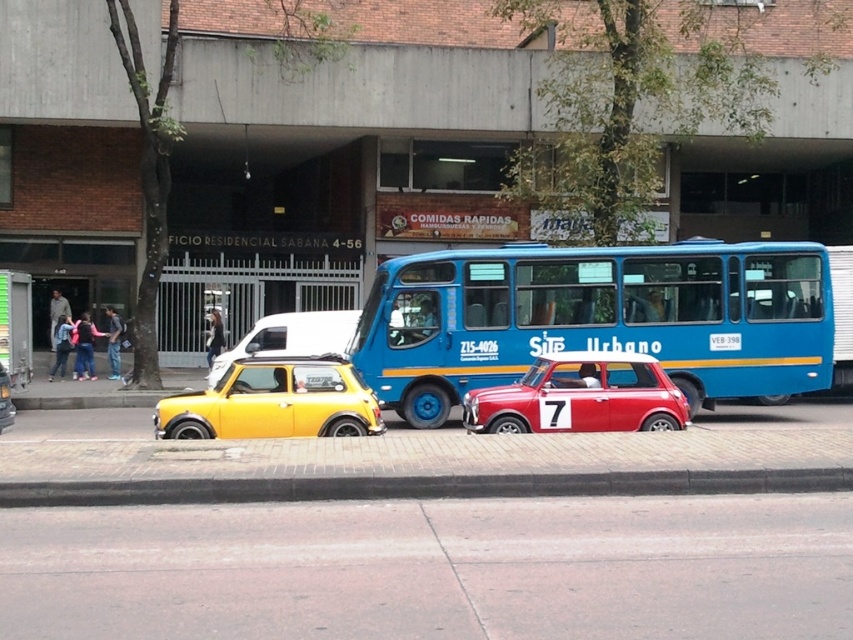
In the scene shown: You are a delivery person trying to navigate through the street scene. You need to deliver a package to a location marked by point A at point [671,486] and then to point B at point [379,408]. Which point should you visit first to follow the correct path?

You should visit point A at point [671,486] first because it is in front of point B at point [379,408], so you can reach it before moving to the latter.

You are a delivery person needing to cross the street where the shiny red car at center and the yellow matte hatchback at center are parked. The road is 8 meters wide. Can you safely cross without moving any vehicles?

The distance between the shiny red car at center and the yellow matte hatchback at center is 6.33 meters. Since the road is 8 meters wide, there is enough space remaining to cross safely without moving any vehicles.

You are a pedestrian standing at the curb and see the blue metallic bus at center and the shiny yellow car at center. Which one is positioned to the right side from your perspective?

The blue metallic bus at center is positioned to the right of the shiny yellow car at center.